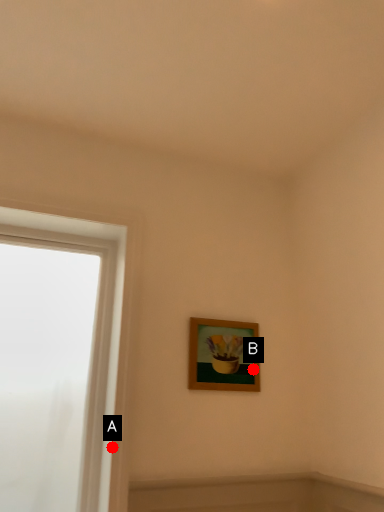
Question: Two points are circled on the image, labeled by A and B beside each circle. Which of the following is the farthest from the observer?

Choices:
 (A) A is further
 (B) B is further

Answer: (B)